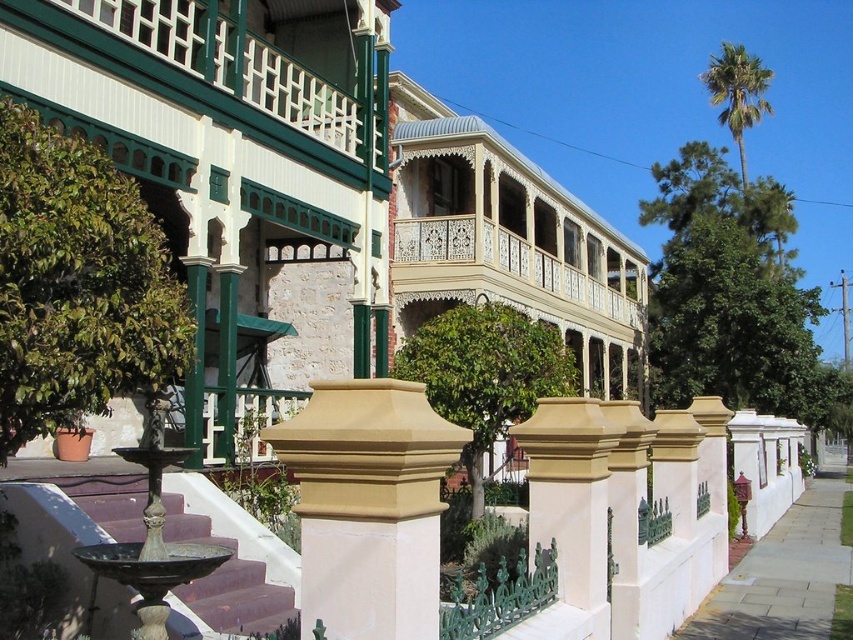
Is white painted wood balcony at upper center smaller than white painted wood at upper center?

Incorrect, white painted wood balcony at upper center is not smaller in size than white painted wood at upper center.

This screenshot has width=853, height=640. What do you see at coordinates (503, 234) in the screenshot? I see `white painted wood balcony at upper center` at bounding box center [503, 234].

Is point (511, 224) behind point (202, 90)?

That is True.

Identify the location of white painted wood balcony at upper center. This screenshot has width=853, height=640. (503, 234).

Between point (322, 168) and point (738, 134), which one is positioned behind?

Point (738, 134)

Which is behind, point (260, 116) or point (711, 81)?

The point (711, 81) is more distant.

I want to click on white painted wood at upper center, so click(x=167, y=83).

Is point (529, 196) farther from camera compared to point (714, 90)?

No.

Locate an element on the screen. white painted wood balcony at upper center is located at coordinates (503, 234).

Does point (474, 120) come farther from viewer compared to point (734, 56)?

No, it is in front of (734, 56).

Identify the location of white painted wood balcony at upper center. (503, 234).